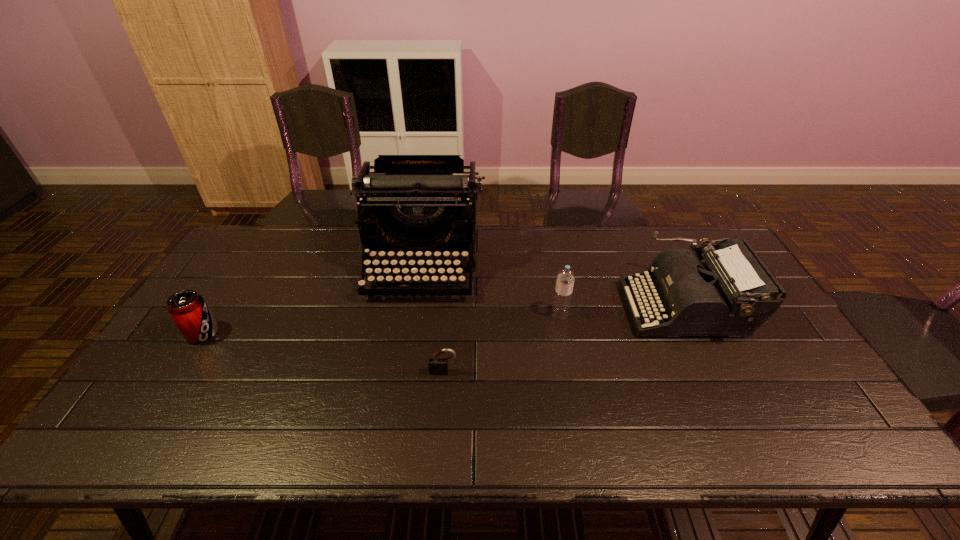
Identify the location of empty space that is in between the padlock and the right typewriter. (564, 339).

The width and height of the screenshot is (960, 540). Identify the location of free space between the soda can and the tallest object. (313, 300).

Locate an element on the screen. This screenshot has width=960, height=540. free space that is in between the soda can and the tallest object is located at coordinates (313, 300).

Identify which object is the second closest to the water bottle. Please provide its 2D coordinates. Your answer should be formatted as a tuple, i.e. [(x, y)], where the tuple contains the x and y coordinates of a point satisfying the conditions above.

[(413, 202)]

You are a GUI agent. You are given a task and a screenshot of the screen. Output one action in this format:
    pyautogui.click(x=<x>, y=<y>)
    Task: Click on the second closest object to the leftmost object
    
    Given the screenshot: What is the action you would take?
    pyautogui.click(x=437, y=365)

The image size is (960, 540). What are the coordinates of `vacant space that satisfies the following two spatial constraints: 1. on the typing side of the water bottle; 2. on the right side of the taller typewriter` in the screenshot? It's located at (415, 314).

Where is `free location that satisfies the following two spatial constraints: 1. on the front-facing side of the shorter typewriter; 2. with the keyhole on the front of the padlock`? The height and width of the screenshot is (540, 960). free location that satisfies the following two spatial constraints: 1. on the front-facing side of the shorter typewriter; 2. with the keyhole on the front of the padlock is located at coordinates (716, 372).

At what (x,y) coordinates should I click in order to perform the action: click on vacant area in the image that satisfies the following two spatial constraints: 1. on the front-facing side of the right typewriter; 2. with the keyhole on the front of the padlock. Please return your answer as a coordinate pair (x, y). Image resolution: width=960 pixels, height=540 pixels. Looking at the image, I should click on point(716,372).